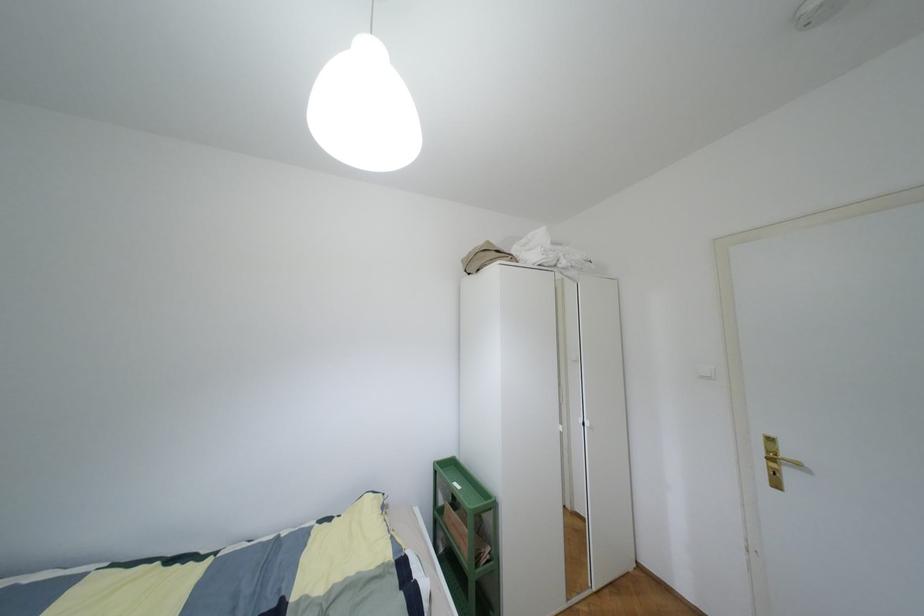
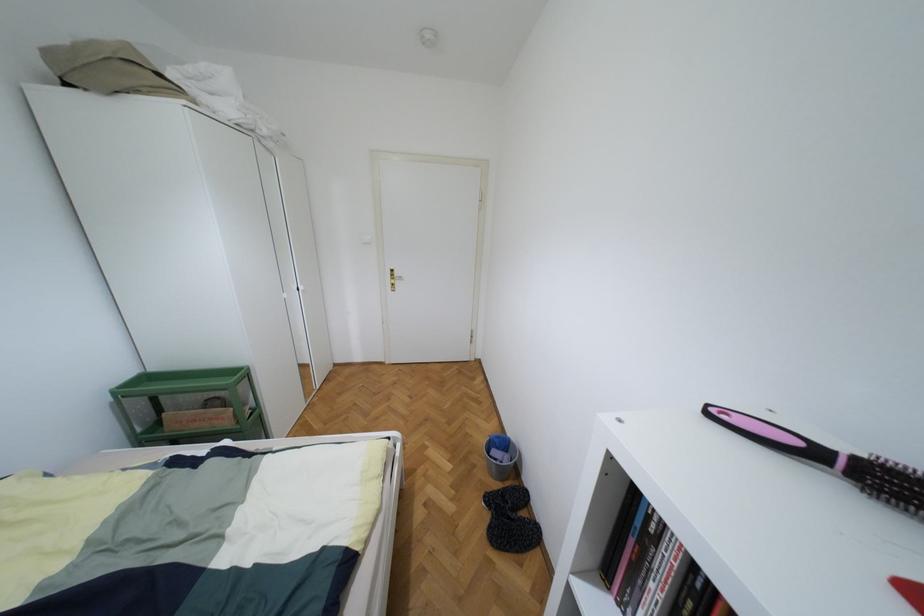
The first image is from the beginning of the video and the second image is from the end. How did the camera likely rotate when shooting the video?

The camera rotated toward right-down.